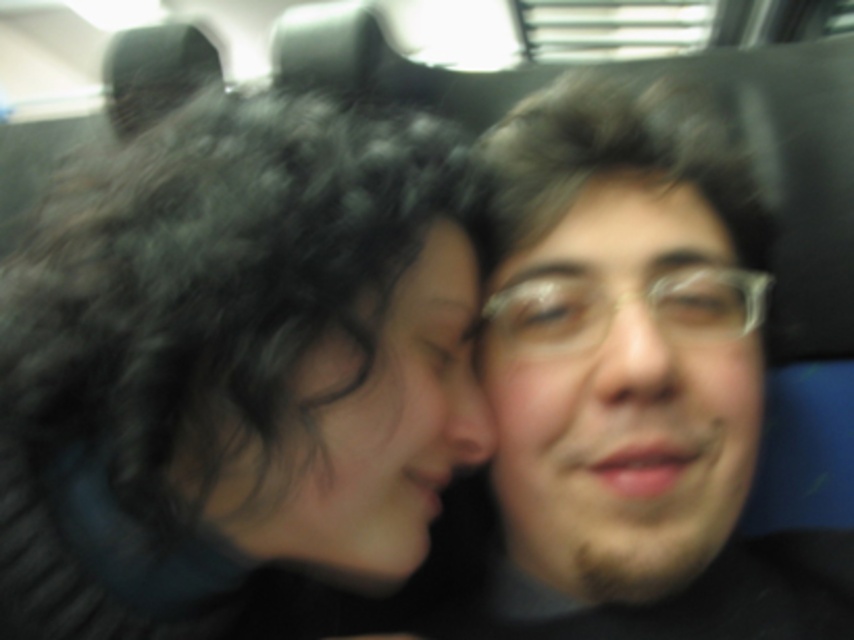
Question: Does black curly hair at left come behind smooth skin face at center?

Choices:
 (A) yes
 (B) no

Answer: (B)

Question: Can you confirm if black curly hair at left is thinner than smooth skin face at center?

Choices:
 (A) no
 (B) yes

Answer: (A)

Question: Does black curly hair at left have a smaller size compared to smooth skin face at center?

Choices:
 (A) yes
 (B) no

Answer: (B)

Question: Which point is farther from the camera taking this photo?

Choices:
 (A) (110, 355)
 (B) (611, 342)

Answer: (B)

Question: Which of the following is the farthest from the observer?

Choices:
 (A) (747, 560)
 (B) (34, 628)

Answer: (A)